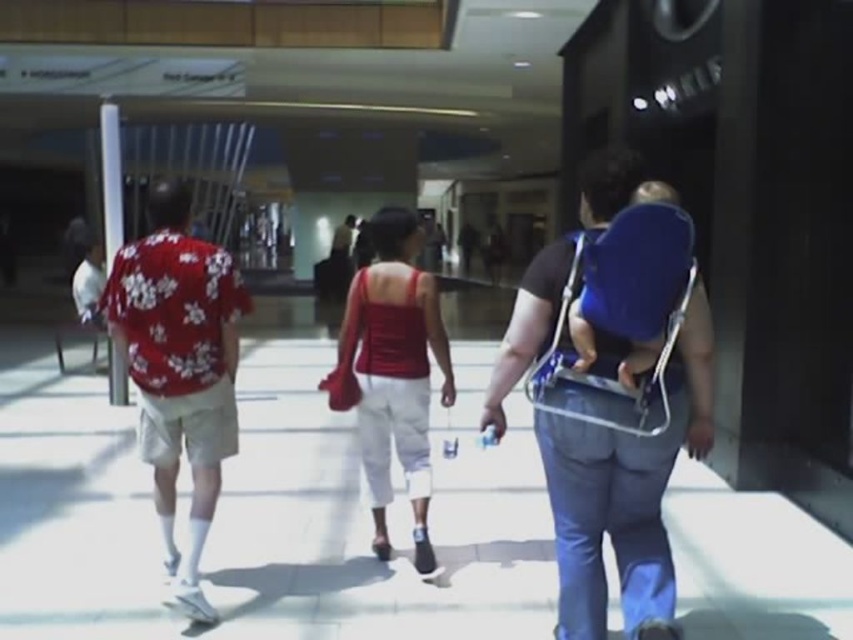
Question: Can you confirm if blue fabric baby carrier at right is positioned above matte red tank top at center?

Choices:
 (A) no
 (B) yes

Answer: (B)

Question: Which of the following is the closest to the observer?

Choices:
 (A) blue fabric baby carrier at right
 (B) matte red tank top at center

Answer: (A)

Question: Does blue fabric baby carrier at right appear under matte red tank top at center?

Choices:
 (A) yes
 (B) no

Answer: (B)

Question: Does blue fabric baby carrier at right have a greater width compared to floral-patterned shirt at left?

Choices:
 (A) yes
 (B) no

Answer: (A)

Question: Based on their relative distances, which object is nearer to the floral-patterned shirt at left?

Choices:
 (A) blue fabric baby carrier at right
 (B) matte red tank top at center

Answer: (B)

Question: Which point is closer to the camera?

Choices:
 (A) (614, 433)
 (B) (224, 371)

Answer: (A)